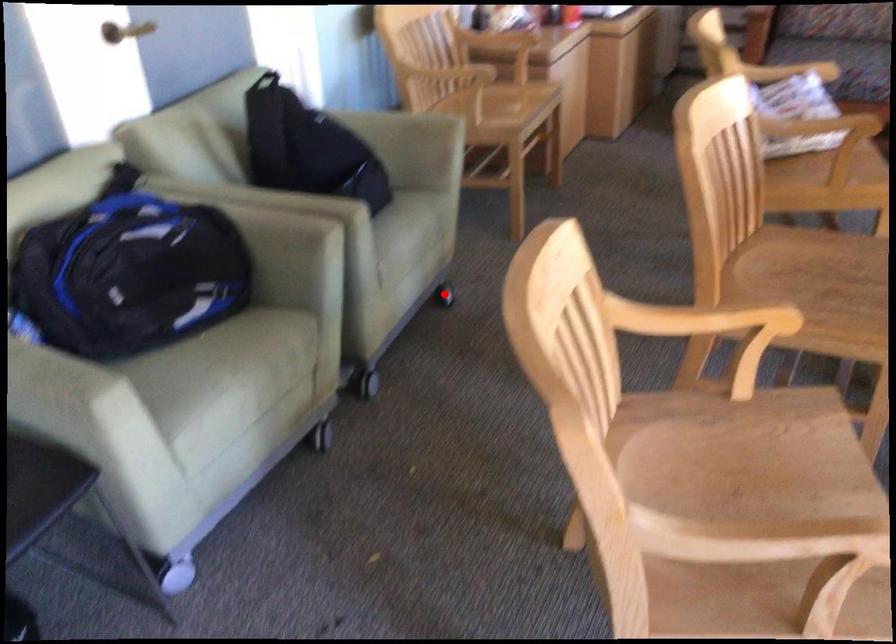
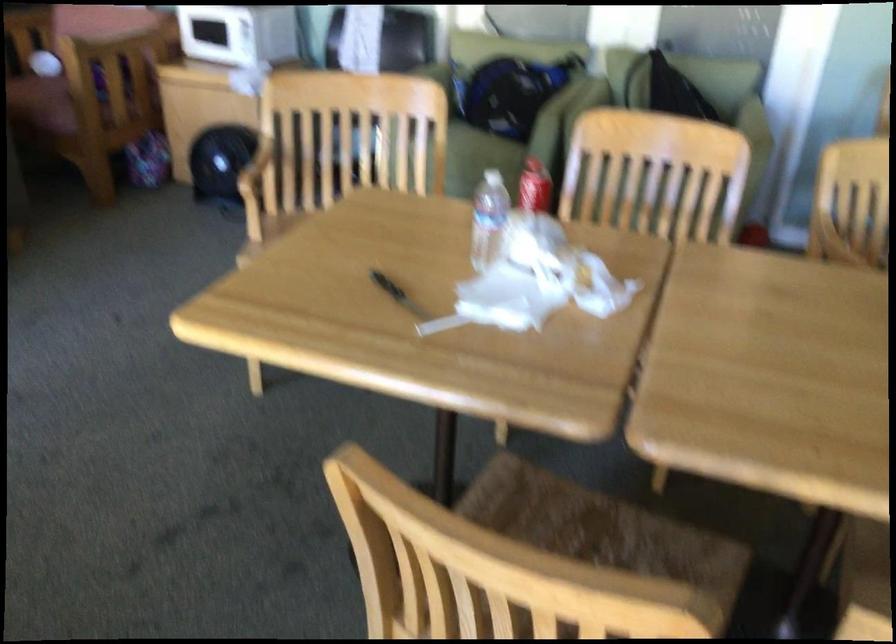
Question: I am providing you with two images of the same scene from different viewpoints. A red point is marked on the first image. Is the red point's position out of view in image 2?

Choices:
 (A) Yes
 (B) No

Answer: (A)